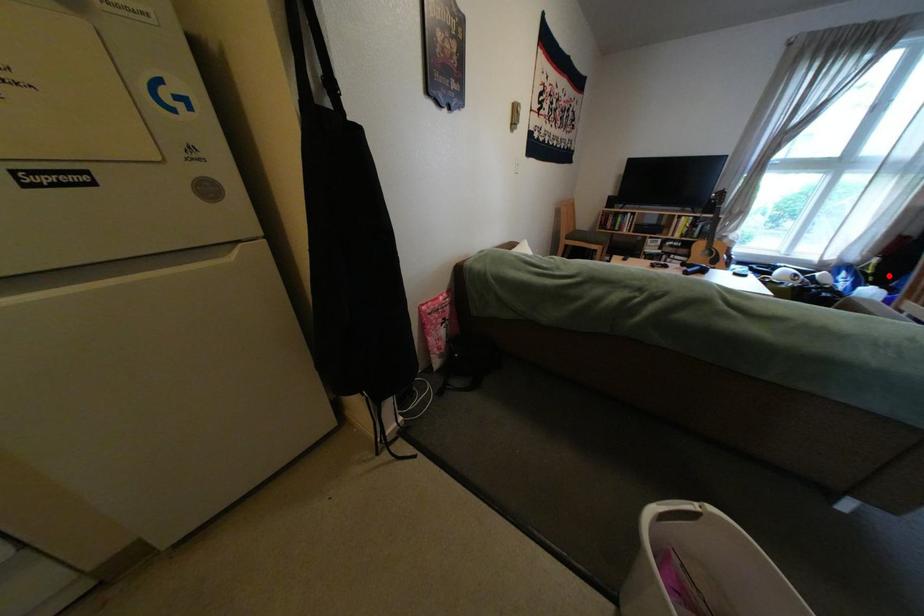
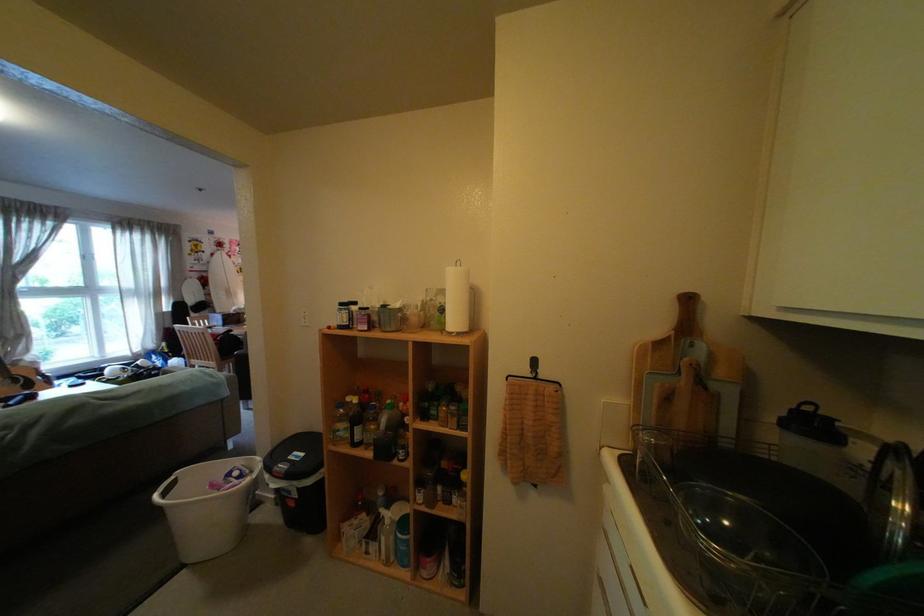
Question: I am providing you with two images of the same scene from different viewpoints. A red point is marked on the first image. At the location where the point appears in image 1, is it still visible in image 2?

Choices:
 (A) Yes
 (B) No

Answer: (A)